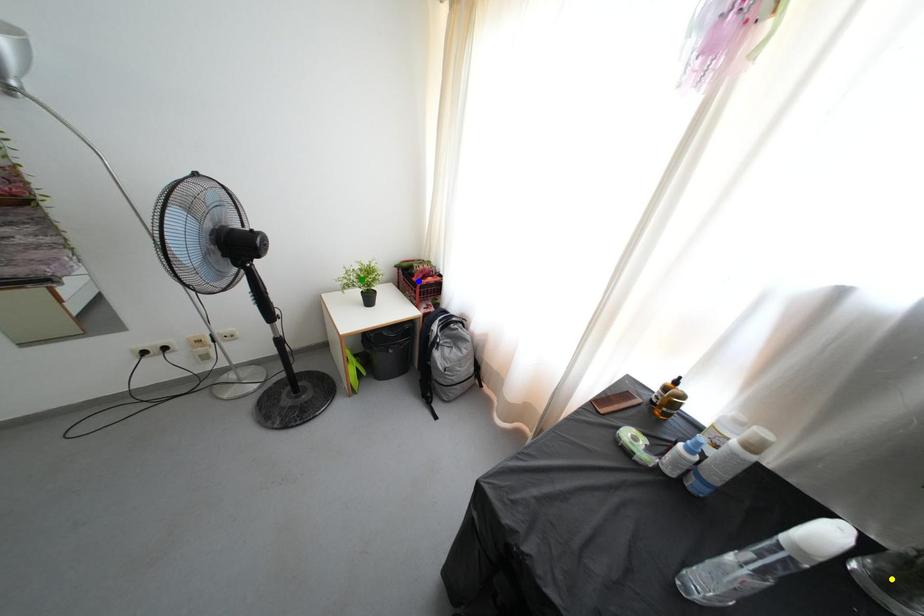
Order these from farthest to nearest:
A) blue point
B) green point
C) yellow point

blue point < green point < yellow point